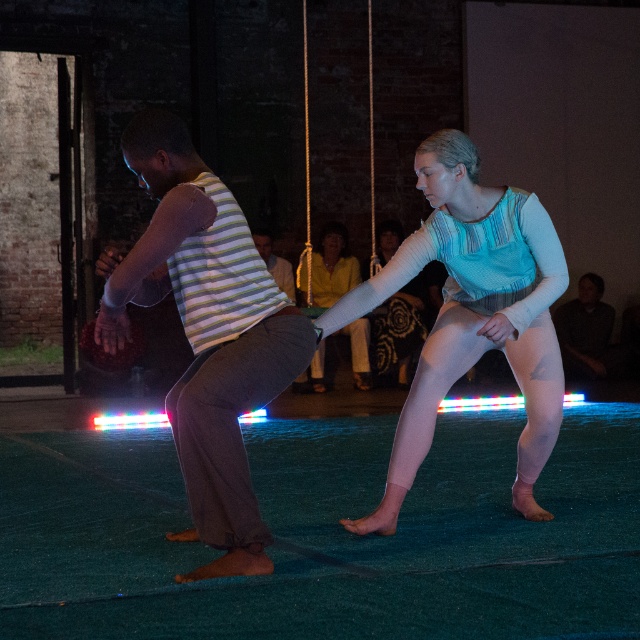
Between dark gray sweater at center and striped fabric at center, which one appears on the left side from the viewer's perspective?

striped fabric at center

The height and width of the screenshot is (640, 640). What do you see at coordinates (586, 333) in the screenshot? I see `dark gray sweater at center` at bounding box center [586, 333].

Find the location of `dark gray sweater at center`. dark gray sweater at center is located at coordinates (586, 333).

Identify the location of light blue fabric at center. (332, 268).

Does point (353, 353) come farther from viewer compared to point (586, 307)?

No.

Find the location of a particular element. This screenshot has height=640, width=640. light blue fabric at center is located at coordinates (332, 268).

The image size is (640, 640). Identify the location of striped cotton tank top at left. (205, 332).

What do you see at coordinates (205, 332) in the screenshot? I see `striped cotton tank top at left` at bounding box center [205, 332].

Identify the location of striped cotton tank top at left. This screenshot has height=640, width=640. (205, 332).